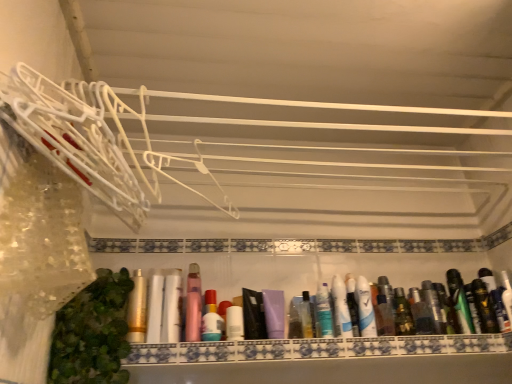
This screenshot has width=512, height=384. Identify the location of matte plastic bottles at center. (316, 348).

Image resolution: width=512 pixels, height=384 pixels. What do you see at coordinates (234, 323) in the screenshot?
I see `white matte lotion at center, placed as the eleventh toiletry when sorted from right to left` at bounding box center [234, 323].

The image size is (512, 384). What do you see at coordinates (433, 305) in the screenshot?
I see `metallic silver spray can at center right, positioned as the 12th toiletry in left-to-right order` at bounding box center [433, 305].

At what (x,y) coordinates should I click in order to perform the action: click on matte black deodorant at center right, the 16th toiletry in the left-to-right sequence. Please return your answer as a coordinate pair (x, y). Looking at the image, I should click on (500, 309).

This screenshot has width=512, height=384. What are the coordinates of `matte plastic bottles at center` in the screenshot? It's located at (316, 348).

Is white glossy lotion at center, positioned as the 6th toiletry in left-to-right order, taller than matte black deodorant at center right, marked as the second toiletry in a right-to-left arrangement?

Yes, white glossy lotion at center, positioned as the 6th toiletry in left-to-right order, is taller than matte black deodorant at center right, marked as the second toiletry in a right-to-left arrangement.

From the picture: Are white glossy lotion at center, the 12th toiletry positioned from the right, and matte black deodorant at center right, the 16th toiletry in the left-to-right sequence, far apart?

They are positioned close to each other.

Is point (224, 337) closer or farther from the camera than point (502, 325)?

Point (224, 337) is closer to the camera than point (502, 325).

From a real-world perspective, is white glossy lotion at center, the 12th toiletry positioned from the right, located higher than matte black deodorant at center right, marked as the second toiletry in a right-to-left arrangement?

Yes, from a real-world perspective, white glossy lotion at center, the 12th toiletry positioned from the right, is on top of matte black deodorant at center right, marked as the second toiletry in a right-to-left arrangement.

From the image's perspective, does matte black deodorant at center right, marked as the second toiletry in a right-to-left arrangement, appear lower than white plastic hangers at left?

Yes, from the image's perspective, matte black deodorant at center right, marked as the second toiletry in a right-to-left arrangement, is beneath white plastic hangers at left.

Considering their positions, is matte black deodorant at center right, marked as the second toiletry in a right-to-left arrangement, located in front of or behind white plastic hangers at left?

Clearly, matte black deodorant at center right, marked as the second toiletry in a right-to-left arrangement, is behind white plastic hangers at left.

Considering the sizes of matte black deodorant at center right, marked as the second toiletry in a right-to-left arrangement, and white plastic hangers at left in the image, is matte black deodorant at center right, marked as the second toiletry in a right-to-left arrangement, wider or thinner than white plastic hangers at left?

matte black deodorant at center right, marked as the second toiletry in a right-to-left arrangement, is thinner than white plastic hangers at left.

Considering the sizes of matte black deodorant at center right, marked as the second toiletry in a right-to-left arrangement, and white plastic hangers at left in the image, is matte black deodorant at center right, marked as the second toiletry in a right-to-left arrangement, bigger or smaller than white plastic hangers at left?

matte black deodorant at center right, marked as the second toiletry in a right-to-left arrangement, is smaller than white plastic hangers at left.

Which object is closer to the camera taking this photo, white glossy lotion at center, the 12th toiletry positioned from the right, or green leafy plant at lower left?

green leafy plant at lower left is in front.

Considering the positions of objects white glossy lotion at center, positioned as the 6th toiletry in left-to-right order, and green leafy plant at lower left in the image provided, who is more to the right, white glossy lotion at center, positioned as the 6th toiletry in left-to-right order, or green leafy plant at lower left?

white glossy lotion at center, positioned as the 6th toiletry in left-to-right order.

Considering the relative sizes of white glossy lotion at center, the 12th toiletry positioned from the right, and green leafy plant at lower left in the image provided, is white glossy lotion at center, the 12th toiletry positioned from the right, taller than green leafy plant at lower left?

No, white glossy lotion at center, the 12th toiletry positioned from the right, is not taller than green leafy plant at lower left.

Which is behind, shiny black tube at right, the 3th toiletry positioned from the right, or matte white tube at center, positioned as the fifteenth toiletry in right-to-left order?

shiny black tube at right, the 3th toiletry positioned from the right, is further away from the camera.

Who is taller, shiny black tube at right, the 3th toiletry positioned from the right, or matte white tube at center, which is the 3th toiletry in left-to-right order?

With more height is matte white tube at center, which is the 3th toiletry in left-to-right order.

Is shiny black tube at right, which ranks as the 15th toiletry in left-to-right order, not inside matte white tube at center, which is the 3th toiletry in left-to-right order?

Yes, shiny black tube at right, which ranks as the 15th toiletry in left-to-right order, is not within matte white tube at center, which is the 3th toiletry in left-to-right order.

Is point (346, 323) closer to viewer compared to point (287, 345)?

No, (346, 323) is further to viewer.

Considering the relative sizes of white glossy tube at center, which is counted as the 2th toothpaste, starting from the right, and matte plastic bottles at center in the image provided, is white glossy tube at center, which is counted as the 2th toothpaste, starting from the right, shorter than matte plastic bottles at center?

Incorrect, the height of white glossy tube at center, which is counted as the 2th toothpaste, starting from the right, does not fall short of that of matte plastic bottles at center.

You are a GUI agent. You are given a task and a screenshot of the screen. Output one action in this format:
    pyautogui.click(x=<x>, y=<y>)
    Task: Click on the cabinet that appears below the white glossy tube at center, positioned as the 1th toothpaste in left-to-right order (from a real-world perspective)
    The height and width of the screenshot is (384, 512).
    Given the screenshot: What is the action you would take?
    pyautogui.click(x=316, y=348)

Considering the relative positions of white glossy tube at center, which is counted as the 2th toothpaste, starting from the right, and matte plastic bottles at center in the image provided, is white glossy tube at center, which is counted as the 2th toothpaste, starting from the right, to the left or to the right of matte plastic bottles at center?

In the image, white glossy tube at center, which is counted as the 2th toothpaste, starting from the right, appears on the right side of matte plastic bottles at center.

Considering the positions of objects green matte deodorant at right, marked as the fourteenth toiletry in a left-to-right arrangement, and metallic silver spray can at right, placed as the eleventh toiletry when sorted from left to right, in the image provided, who is in front, green matte deodorant at right, marked as the fourteenth toiletry in a left-to-right arrangement, or metallic silver spray can at right, placed as the eleventh toiletry when sorted from left to right,?

metallic silver spray can at right, placed as the eleventh toiletry when sorted from left to right, is closer to the camera.

From a real-world perspective, is green matte deodorant at right, the 4th toiletry when ordered from right to left, physically above metallic silver spray can at right, placed as the eleventh toiletry when sorted from left to right?

Indeed, from a real-world perspective, green matte deodorant at right, the 4th toiletry when ordered from right to left, stands above metallic silver spray can at right, placed as the eleventh toiletry when sorted from left to right.

Does green matte deodorant at right, the 4th toiletry when ordered from right to left, have a lesser width compared to metallic silver spray can at right, which appears as the 7th toiletry when viewed from the right?

Incorrect, the width of green matte deodorant at right, the 4th toiletry when ordered from right to left, is not less than that of metallic silver spray can at right, which appears as the 7th toiletry when viewed from the right.

Is metallic silver spray can at right, which is the 5th toiletry in right-to-left order, positioned far away from matte black deodorant at center right, marked as the second toiletry in a right-to-left arrangement?

metallic silver spray can at right, which is the 5th toiletry in right-to-left order, is actually quite close to matte black deodorant at center right, marked as the second toiletry in a right-to-left arrangement.

From a real-world perspective, between metallic silver spray can at right, which is the 5th toiletry in right-to-left order, and matte black deodorant at center right, the 16th toiletry in the left-to-right sequence, who is vertically lower?

matte black deodorant at center right, the 16th toiletry in the left-to-right sequence.

From the image's perspective, between metallic silver spray can at right, acting as the thirteenth toiletry starting from the left, and matte black deodorant at center right, the 16th toiletry in the left-to-right sequence, who is located below?

metallic silver spray can at right, acting as the thirteenth toiletry starting from the left.

Image resolution: width=512 pixels, height=384 pixels. Find the location of `the 1st toiletry directly above the matte black deodorant at center right, the 16th toiletry in the left-to-right sequence (from a real-world perspective)`. the 1st toiletry directly above the matte black deodorant at center right, the 16th toiletry in the left-to-right sequence (from a real-world perspective) is located at coordinates (223, 315).

Where is `hanger lying above the matte black deodorant at center right, the 16th toiletry in the left-to-right sequence (from the image's perspective)`? Image resolution: width=512 pixels, height=384 pixels. hanger lying above the matte black deodorant at center right, the 16th toiletry in the left-to-right sequence (from the image's perspective) is located at coordinates (91, 140).

Looking at the image, which one is located further to metallic silver spray can at right, which is the 5th toiletry in right-to-left order, matte gold tube at center, marked as the 16th toiletry in a right-to-left arrangement, or green matte deodorant at right, the 4th toiletry when ordered from right to left?

matte gold tube at center, marked as the 16th toiletry in a right-to-left arrangement, lies further to metallic silver spray can at right, which is the 5th toiletry in right-to-left order, than the other object.

From the image, which object appears to be farther from metallic silver spray can at right, placed as the eleventh toiletry when sorted from left to right, gold metallic tube at center, which is counted as the 1th toiletry, starting from the left, or white glossy tube at center, arranged as the 2th toothpaste when viewed from the left?

Based on the image, gold metallic tube at center, which is counted as the 1th toiletry, starting from the left, appears to be further to metallic silver spray can at right, placed as the eleventh toiletry when sorted from left to right.

Based on the photo, looking at the image, which one is located closer to white glossy lotion at center, the 12th toiletry positioned from the right, white plastic hangers at left or matte black deodorant at center right, marked as the second toiletry in a right-to-left arrangement?

white plastic hangers at left is closer to white glossy lotion at center, the 12th toiletry positioned from the right.

Estimate the real-world distances between objects in this image. Which object is further from pink matte bottle at center, the fourteenth toiletry from the right, translucent plastic spray can at center, which is the eighth toiletry from left to right, or white matte lotion at center, placed as the eleventh toiletry when sorted from right to left?

translucent plastic spray can at center, which is the eighth toiletry from left to right, is further to pink matte bottle at center, the fourteenth toiletry from the right.

Based on their spatial positions, is white glossy tube at center, which is counted as the 2th toothpaste, starting from the right, or white glossy tube at center, arranged as the 2th toothpaste when viewed from the left, further from metallic silver spray can at right, the 8th toiletry in the right-to-left sequence?

white glossy tube at center, which is counted as the 2th toothpaste, starting from the right.

Based on their spatial positions, is translucent plastic bottle at center, positioned as the 13th toiletry in right-to-left order, or matte white tube at center, which is the 3th toiletry in left-to-right order, closer to metallic silver spray can at right, acting as the thirteenth toiletry starting from the left?

translucent plastic bottle at center, positioned as the 13th toiletry in right-to-left order, lies closer to metallic silver spray can at right, acting as the thirteenth toiletry starting from the left, than the other object.

Which object lies nearer to the anchor point white glossy tube at center, positioned as the 1th toothpaste in left-to-right order, white glossy tube at center, which is the 1th toothpaste from right to left, or matte plastic bottles at center?

The object closer to white glossy tube at center, positioned as the 1th toothpaste in left-to-right order, is white glossy tube at center, which is the 1th toothpaste from right to left.

Based on their spatial positions, is shiny black tube at right, the 3th toiletry positioned from the right, or matte gold tube at center, marked as the 16th toiletry in a right-to-left arrangement, closer to pink matte bottle at center, positioned as the fourth toiletry in left-to-right order?

Among the two, matte gold tube at center, marked as the 16th toiletry in a right-to-left arrangement, is located nearer to pink matte bottle at center, positioned as the fourth toiletry in left-to-right order.

This screenshot has height=384, width=512. In order to click on toiletry between green matte deodorant at right, the 4th toiletry when ordered from right to left, and matte black deodorant at center right, marked as the second toiletry in a right-to-left arrangement, in the horizontal direction in this screenshot , I will do [484, 307].

The width and height of the screenshot is (512, 384). I want to click on hanger between green leafy plant at lower left and metallic silver spray can at center right, positioned as the 12th toiletry in left-to-right order, from left to right, so [91, 140].

This screenshot has width=512, height=384. I want to click on cabinet between gold metallic tube at center, the 17th toiletry viewed from the right, and translucent plastic spray can at center, acting as the tenth toiletry starting from the right, from left to right, so click(316, 348).

I want to click on cabinet between white matte lotion at center, placed as the eleventh toiletry when sorted from right to left, and shiny metallic spray can at center, the 9th toiletry from the left, so click(x=316, y=348).